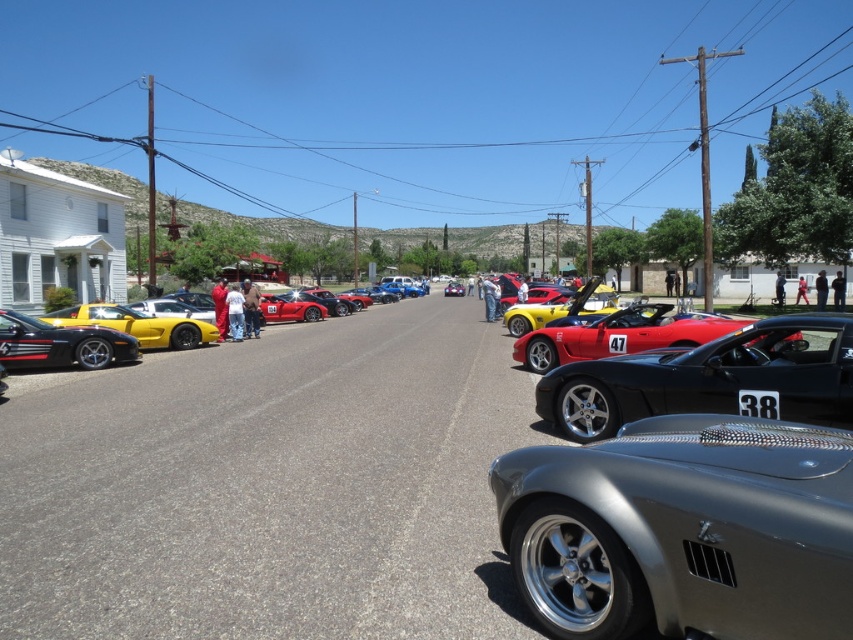
Question: Does metallic silver car at lower right have a greater width compared to shiny red sports car at center?

Choices:
 (A) yes
 (B) no

Answer: (B)

Question: Does shiny black car at center lie behind shiny red convertible at center?

Choices:
 (A) no
 (B) yes

Answer: (A)

Question: Which object appears farthest from the camera in this image?

Choices:
 (A) shiny yellow car at left
 (B) shiny red convertible at center
 (C) shiny black sports car at left

Answer: (A)

Question: Where is shiny yellow car at left located in relation to shiny red sports car at center in the image?

Choices:
 (A) right
 (B) left

Answer: (B)

Question: Which object appears farthest from the camera in this image?

Choices:
 (A) shiny black car at center
 (B) shiny red convertible at center
 (C) shiny red sports car at center

Answer: (C)

Question: Which point is farther from the camera taking this photo?

Choices:
 (A) (741, 356)
 (B) (51, 321)
 (C) (534, 356)
 (D) (308, 307)

Answer: (D)